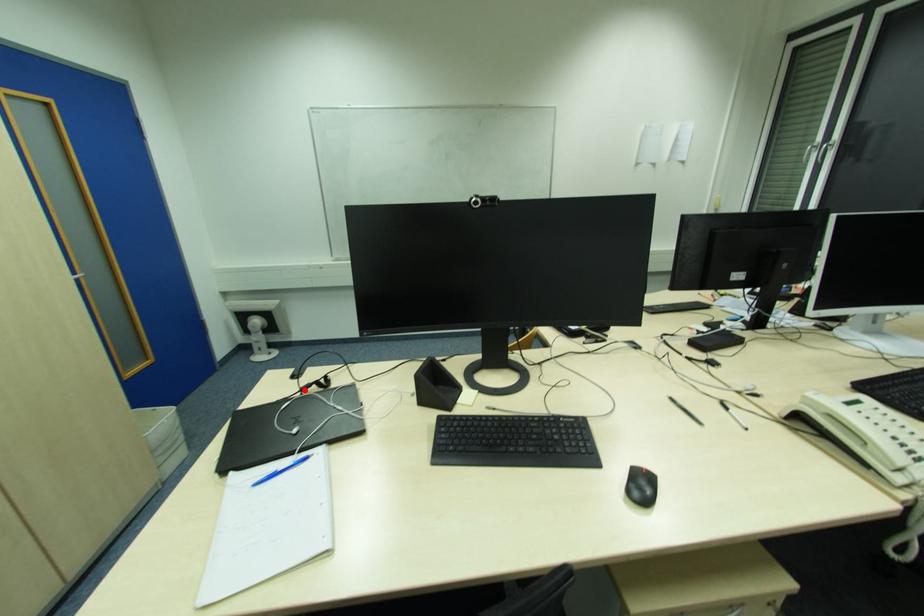
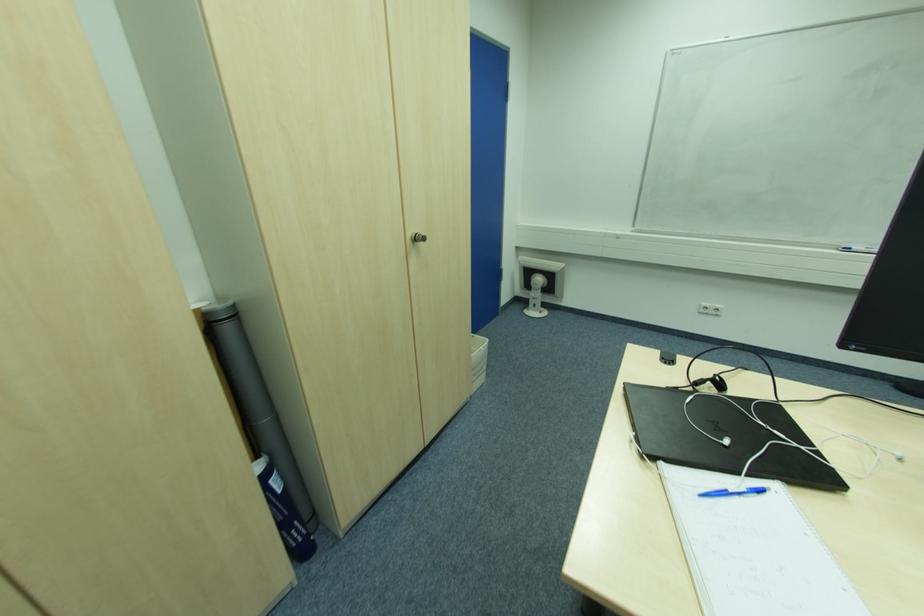
In the second image, find the point that corresponds to the highlighted location in the first image.

(699, 385)